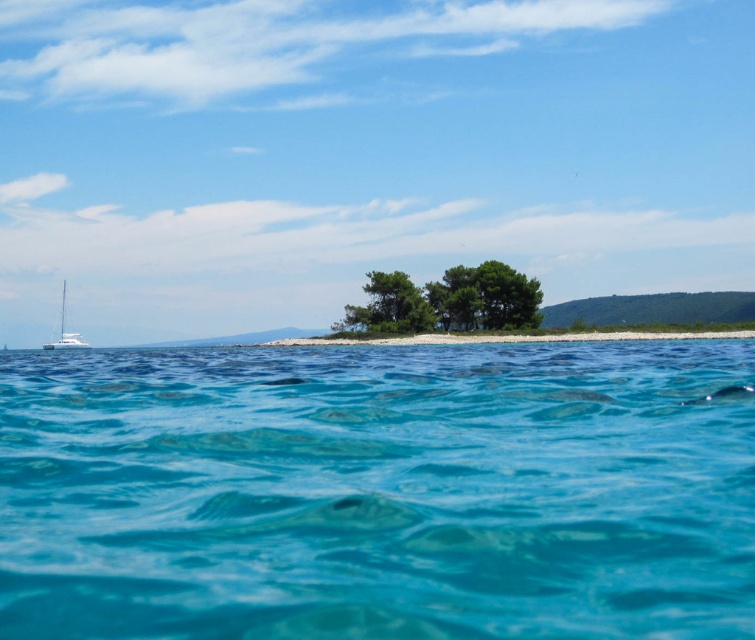
Question: Which point is closer to the camera taking this photo?

Choices:
 (A) (60, 321)
 (B) (374, 292)
 (C) (464, 282)

Answer: (C)

Question: Can you confirm if green leafy trees at center is positioned to the right of green leafy tree at center?

Choices:
 (A) no
 (B) yes

Answer: (B)

Question: Among these points, which one is nearest to the camera?

Choices:
 (A) (458, 289)
 (B) (427, 316)

Answer: (B)

Question: Which object is closer to the camera taking this photo?

Choices:
 (A) green leafy trees at center
 (B) green leafy tree at center
 (C) white glossy sailboat at left
 (D) clear blue water at center

Answer: (D)

Question: Can you confirm if green leafy trees at center is positioned above green leafy tree at center?

Choices:
 (A) no
 (B) yes

Answer: (B)

Question: Observing the image, what is the correct spatial positioning of green leafy tree at center in reference to white glossy sailboat at left?

Choices:
 (A) right
 (B) left

Answer: (A)